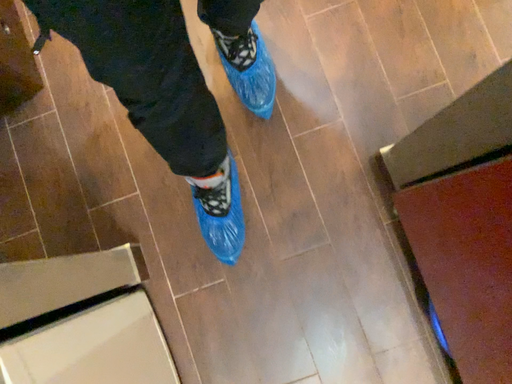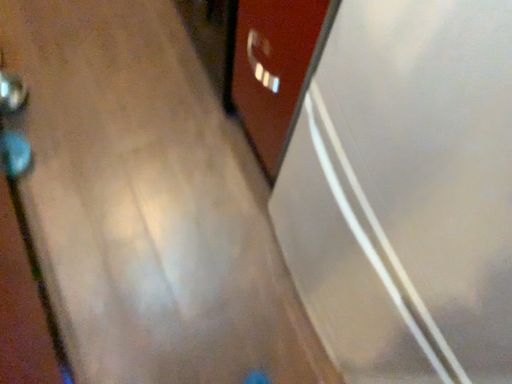
Question: How did the camera likely rotate when shooting the video?

Choices:
 (A) rotated downward
 (B) rotated upward

Answer: (B)